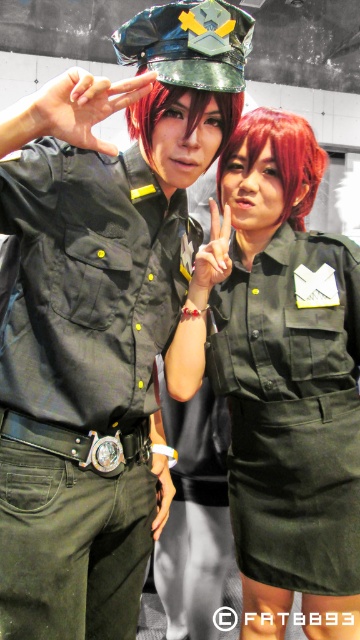
Which is in front, point (65, 253) or point (236, 324)?

Point (65, 253)

Is matte black shirt at left wider than matte green uniform at center?

No, matte black shirt at left is not wider than matte green uniform at center.

Which is in front, point (99, 580) or point (243, 180)?

Point (99, 580)

Locate an element on the screen. The image size is (360, 640). matte black shirt at left is located at coordinates (82, 381).

Can you confirm if matte black shirt at left is positioned to the left of shiny red hair at center?

Yes, matte black shirt at left is to the left of shiny red hair at center.

Can you confirm if matte black shirt at left is bigger than shiny red hair at center?

Indeed, matte black shirt at left has a larger size compared to shiny red hair at center.

Describe the element at coordinates (82, 381) in the screenshot. I see `matte black shirt at left` at that location.

In order to click on matte black shirt at left in this screenshot , I will do `click(82, 381)`.

Can you confirm if matte green uniform at center is bigger than shiny red wig at center?

Yes.

Is point (270, 442) more distant than point (236, 148)?

No, it is in front of (236, 148).

Find the location of a particular element. This screenshot has width=360, height=640. matte green uniform at center is located at coordinates (285, 378).